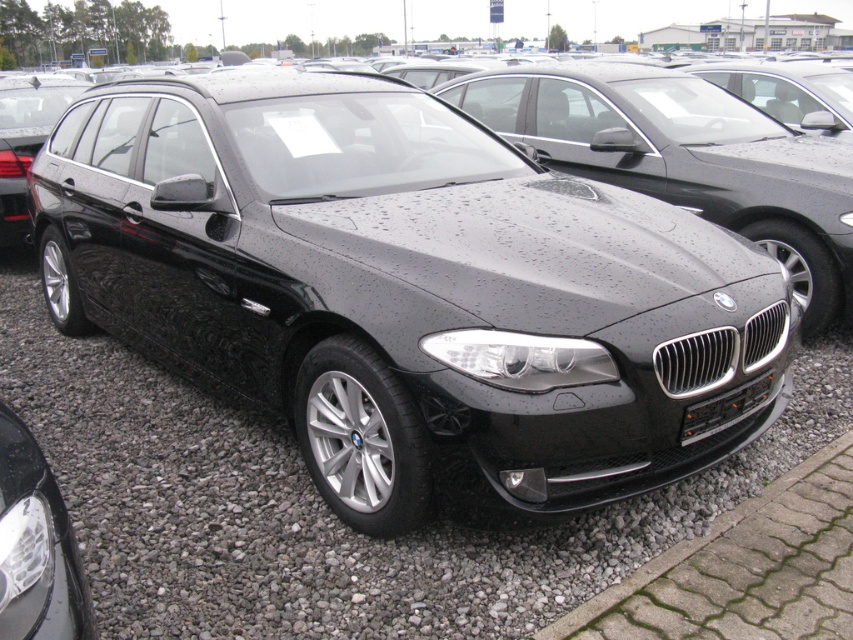
Question: Does gray gravel at center lie in front of black metallic license plate at center?

Choices:
 (A) yes
 (B) no

Answer: (A)

Question: Which point is farther to the camera?

Choices:
 (A) black metallic license plate at center
 (B) gray gravel at center

Answer: (A)

Question: Does gray gravel at center appear over black metallic license plate at center?

Choices:
 (A) yes
 (B) no

Answer: (B)

Question: Does gray gravel at center have a lesser width compared to black metallic license plate at center?

Choices:
 (A) no
 (B) yes

Answer: (A)